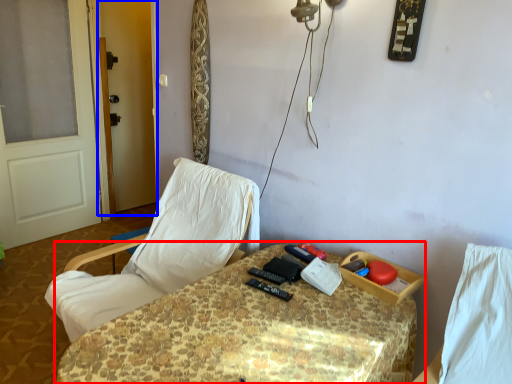
Question: Which of the following is the closest to the observer, table (highlighted by a red box) or screen door (highlighted by a blue box)?

Choices:
 (A) table
 (B) screen door

Answer: (A)